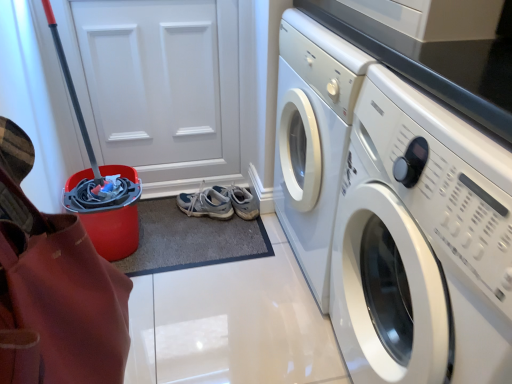
Question: Is point click(350, 144) positioned closer to the camera than point click(62, 317)?

Choices:
 (A) farther
 (B) closer

Answer: (A)

Question: From their relative heights in the image, would you say white glossy washing machine at right is taller or shorter than red plastic bucket at left?

Choices:
 (A) tall
 (B) short

Answer: (A)

Question: Estimate the real-world distances between objects in this image. Which object is farther from the light gray fabric running shoe at center?

Choices:
 (A) white glossy washing machine at right
 (B) red plastic bucket at left
 (C) white matte door at upper left

Answer: (B)

Question: Which of these objects is positioned farthest from the red plastic bucket at left?

Choices:
 (A) white glossy washing machine at right
 (B) light gray fabric running shoe at center
 (C) white matte door at upper left

Answer: (B)